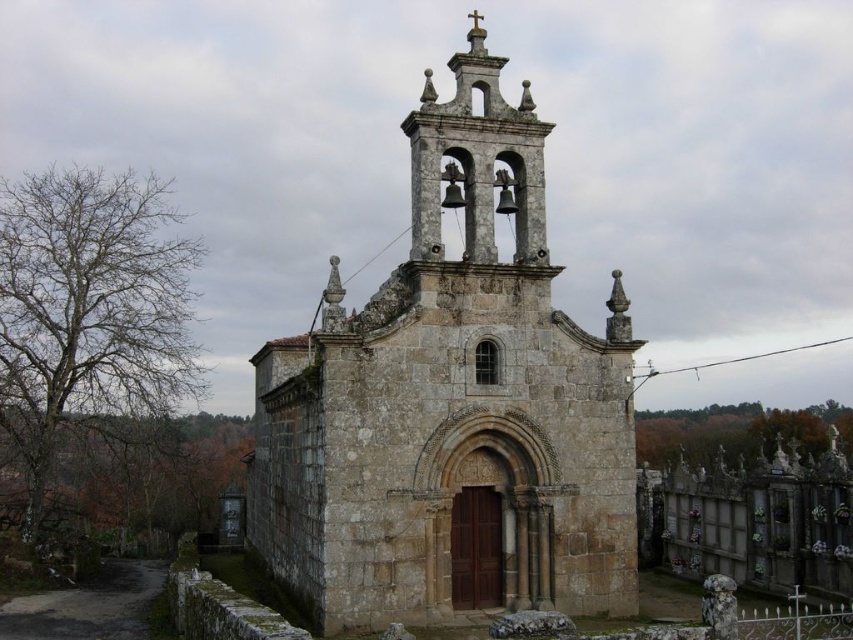
Which is behind, point (421, 172) or point (515, 164)?

Point (515, 164)

Which of these two, rustic stone church at center or stone bell tower at upper center, stands taller?

rustic stone church at center is taller.

Describe the element at coordinates (451, 406) in the screenshot. I see `rustic stone church at center` at that location.

Where is `rustic stone church at center`? This screenshot has width=853, height=640. rustic stone church at center is located at coordinates (451, 406).